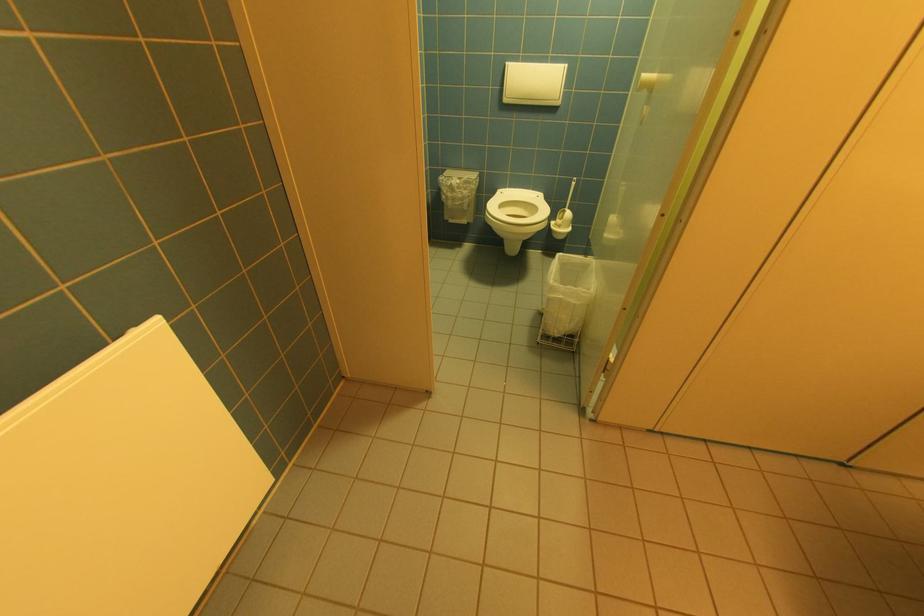
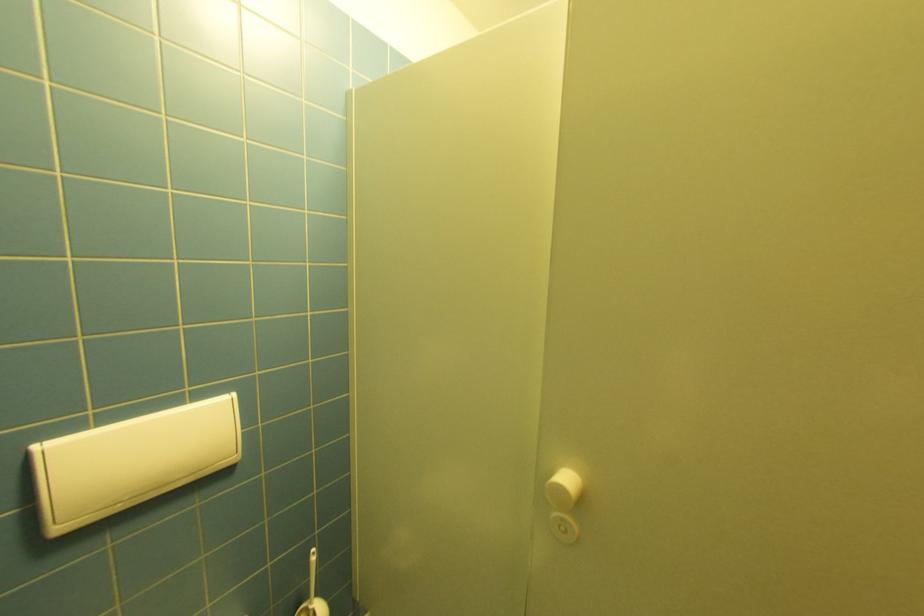
Locate, in the second image, the point that corresponds to [512,100] in the first image.

(66, 530)